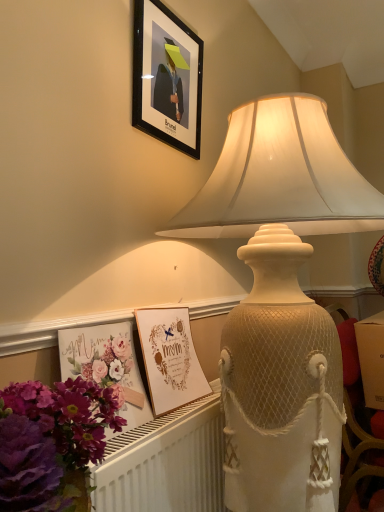
Find the location of a particular element. vacant space in front of matte gold postcard at lower center, arranged as the 2th postcard when viewed from the front is located at coordinates (170, 422).